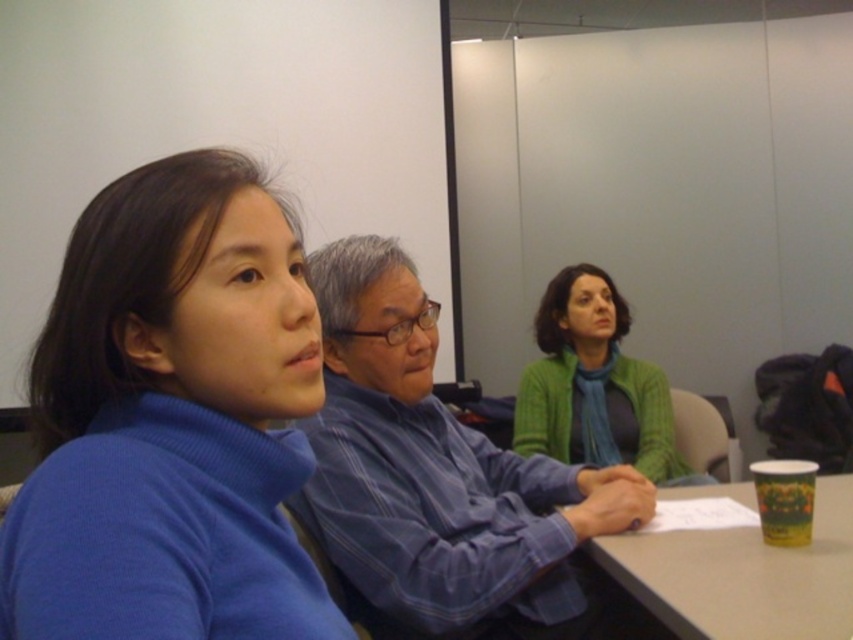
Question: Does blue striped shirt at center appear over yellow paper cup at lower right?

Choices:
 (A) no
 (B) yes

Answer: (B)

Question: Which is farther from the blue striped shirt at center?

Choices:
 (A) yellow paper cup at lower right
 (B) green knitted sweater at center

Answer: (B)

Question: Which point is farther to the camera?

Choices:
 (A) yellow paper cup at lower right
 (B) green knitted sweater at center
 (C) blue striped shirt at center

Answer: (B)

Question: Can you confirm if yellow paper cup at lower right is positioned to the right of green knitted sweater at center?

Choices:
 (A) no
 (B) yes

Answer: (B)

Question: Is yellow paper cup at lower right positioned at the back of green knitted sweater at center?

Choices:
 (A) no
 (B) yes

Answer: (A)

Question: Based on their relative distances, which object is farther from the yellow paper cup at lower right?

Choices:
 (A) blue striped shirt at center
 (B) green knitted sweater at center

Answer: (B)